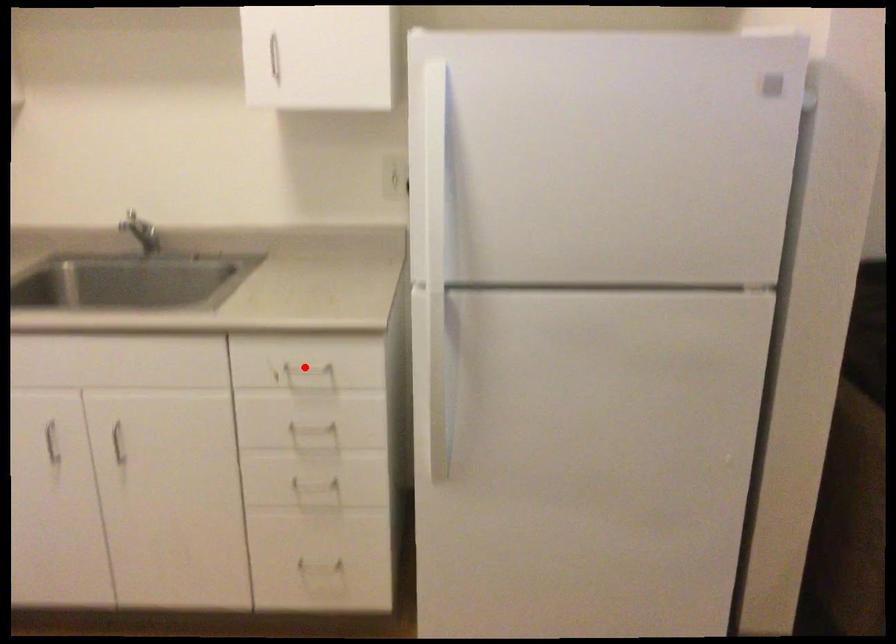
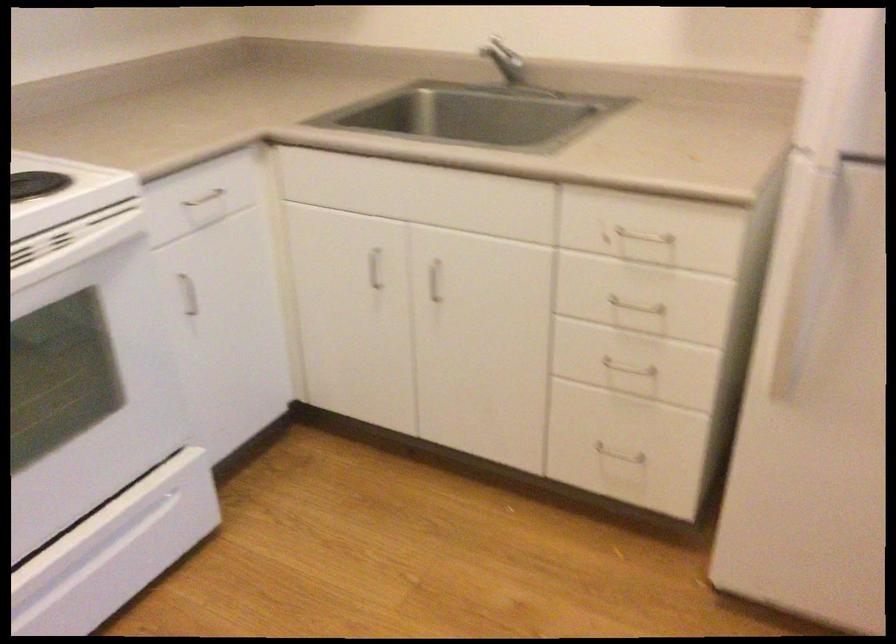
Question: I am providing you with two images of the same scene from different viewpoints. In image1, a red point is highlighted. Considering the same 3D point in image2, which of the following is correct?

Choices:
 (A) It is closer
 (B) It is farther

Answer: (A)